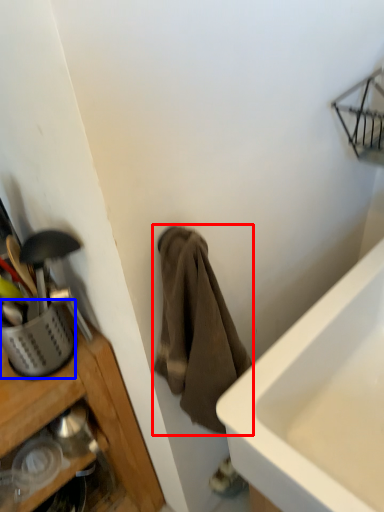
Question: Which of the following is the farthest to the observer, towel/napkin (highlighted by a red box) or basket (highlighted by a blue box)?

Choices:
 (A) towel/napkin
 (B) basket

Answer: (B)